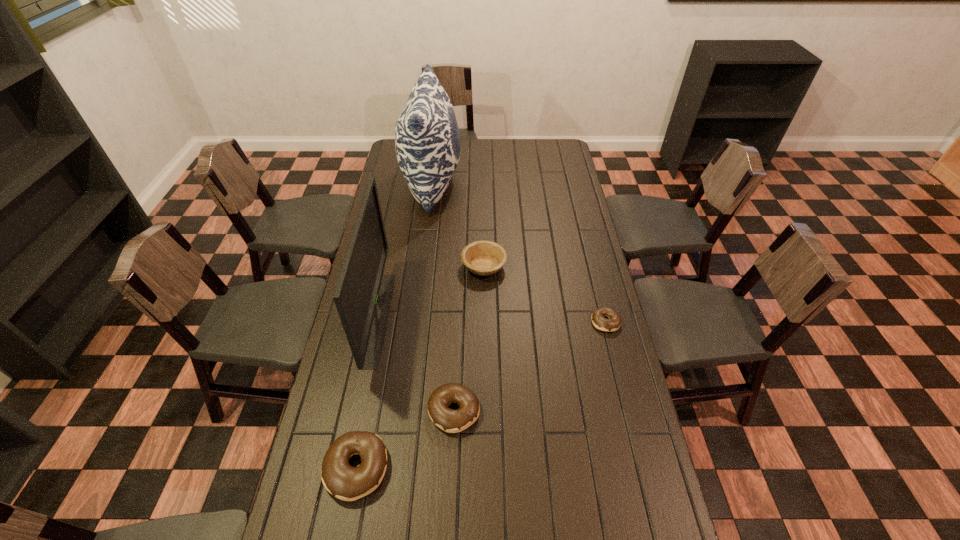
I want to click on blank area located on the back of the second farthest doughnut, so click(x=459, y=294).

Locate an element on the screen. The width and height of the screenshot is (960, 540). blank space located on the back of the shortest doughnut is located at coordinates (588, 251).

Locate an element on the screen. vacant area situated on the back of the bowl is located at coordinates [x=484, y=222].

Where is `free space located 0.330m on the front surface of the cushion`? free space located 0.330m on the front surface of the cushion is located at coordinates (531, 184).

Locate an element on the screen. free region located 0.310m on the front-facing side of the monitor is located at coordinates (478, 318).

Locate an element on the screen. This screenshot has height=540, width=960. object positioned at the far edge is located at coordinates (427, 140).

Image resolution: width=960 pixels, height=540 pixels. Find the location of `object present at the near edge`. object present at the near edge is located at coordinates (343, 481).

Image resolution: width=960 pixels, height=540 pixels. Find the location of `doughnut located in the left edge section of the desktop`. doughnut located in the left edge section of the desktop is located at coordinates (343, 481).

Image resolution: width=960 pixels, height=540 pixels. What are the coordinates of `cushion that is at the left edge` in the screenshot? It's located at (427, 140).

This screenshot has height=540, width=960. Identify the location of monitor positioned at the left edge. (363, 294).